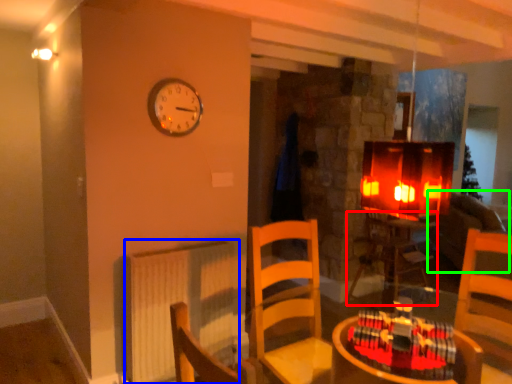
Question: Which object is the farthest from table (highlighted by a red box)? Choose among these: radiator (highlighted by a blue box) or couch (highlighted by a green box).

Choices:
 (A) radiator
 (B) couch

Answer: (A)